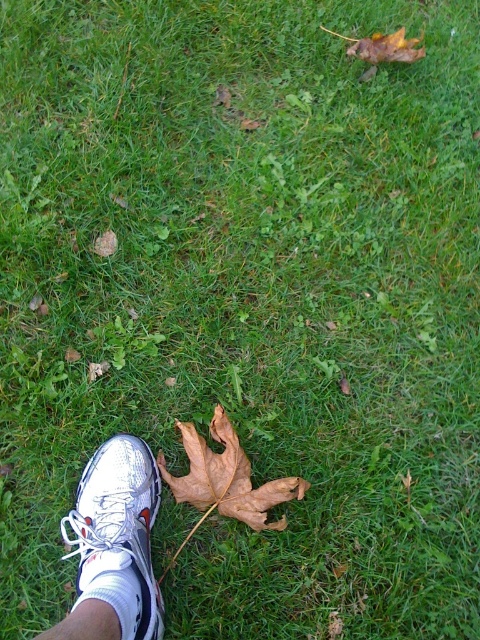
You are a gardener who needs to avoid stepping on the brown papery maple leaf at lower center. Given that your white mesh shoe at lower left is taller than the leaf, will your shoe cover the entire leaf when you step on it?

The white mesh shoe at lower left is taller than the brown papery maple leaf at lower center, so when you step on it, the shoe will cover the entire leaf.